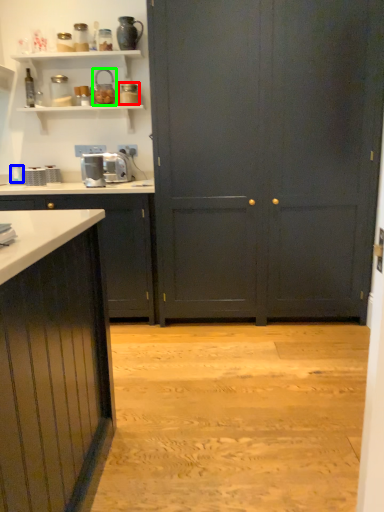
Question: Based on their relative distances, which object is farther from appliance (highlighted by a red box)? Choose from appliance (highlighted by a blue box) and appliance (highlighted by a green box).

Choices:
 (A) appliance
 (B) appliance

Answer: (A)